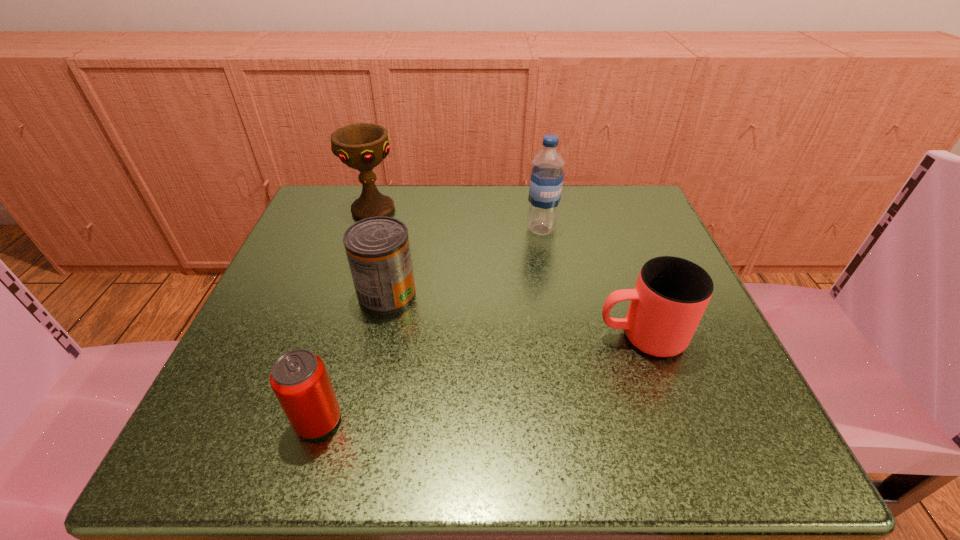
In the image, there is a desktop. Find the location of `vacant space at the far edge`. vacant space at the far edge is located at coordinates (499, 232).

In the image, there is a desktop. Where is `vacant space at the near edge`? vacant space at the near edge is located at coordinates (538, 421).

The width and height of the screenshot is (960, 540). Identify the location of free region at the left edge of the desktop. (310, 326).

The height and width of the screenshot is (540, 960). In the image, there is a desktop. In order to click on vacant region at the right edge in this screenshot , I will do `click(645, 259)`.

The image size is (960, 540). Identify the location of vacant area at the far right corner. (650, 244).

This screenshot has height=540, width=960. Find the location of `vacant region at the near right corner`. vacant region at the near right corner is located at coordinates (677, 403).

Locate an element on the screen. This screenshot has height=540, width=960. unoccupied area between the nearest object and the chalice is located at coordinates (346, 315).

Where is `free point between the cup and the chalice`? The width and height of the screenshot is (960, 540). free point between the cup and the chalice is located at coordinates (507, 273).

Identify the location of vacant region between the nearest object and the water bottle. Image resolution: width=960 pixels, height=540 pixels. pyautogui.click(x=430, y=325).

Locate an element on the screen. empty location between the fourth object from left to right and the nearer can is located at coordinates (430, 325).